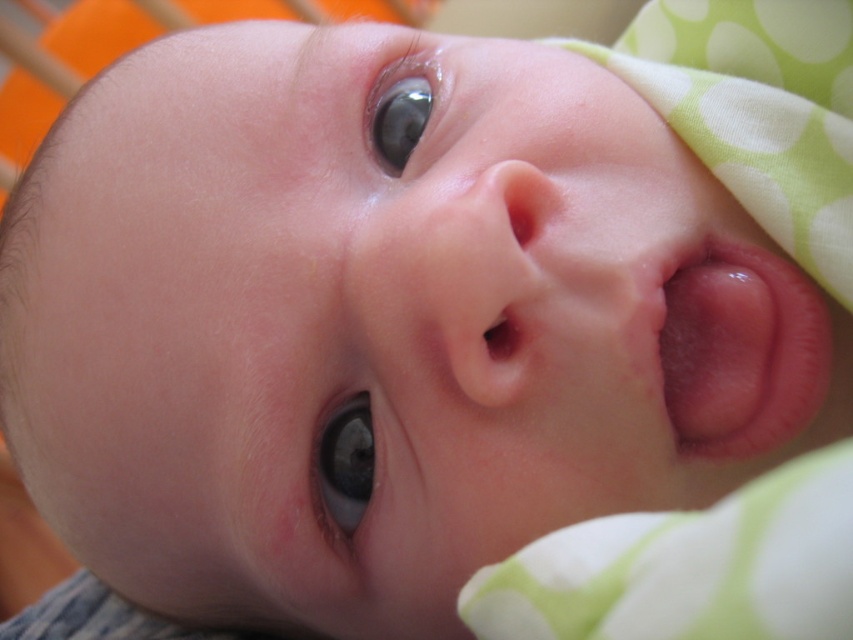
Can you confirm if smooth flesh-colored nose at center is thinner than glossy blue eye at upper center?

In fact, smooth flesh-colored nose at center might be wider than glossy blue eye at upper center.

Can you confirm if smooth flesh-colored nose at center is positioned to the left of glossy blue eye at upper center?

No, smooth flesh-colored nose at center is not to the left of glossy blue eye at upper center.

Between point (466, 304) and point (399, 138), which one is positioned in front?

Point (466, 304) is more forward.

Where is `smooth flesh-colored nose at center`? The width and height of the screenshot is (853, 640). smooth flesh-colored nose at center is located at coordinates (491, 280).

From the picture: How much distance is there between pink smooth tongue at center and blue glossy eye at center?

12.53 centimeters

Can you confirm if pink smooth tongue at center is bigger than blue glossy eye at center?

Yes.

Identify the location of pink smooth tongue at center. The image size is (853, 640). (740, 348).

Locate an element on the screen. pink smooth tongue at center is located at coordinates (740, 348).

Image resolution: width=853 pixels, height=640 pixels. I want to click on pink smooth tongue at center, so click(x=740, y=348).